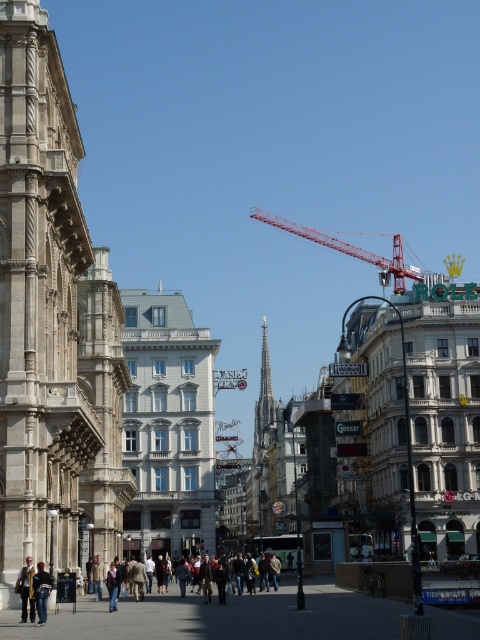
Question: Does white stone tower at left lie in front of gray stone spire at center?

Choices:
 (A) yes
 (B) no

Answer: (A)

Question: Which object appears closest to the camera in this image?

Choices:
 (A) brown leather jacket at center
 (B) dark gray jacket at lower left
 (C) light brown leather jacket at lower left
 (D) white stone tower at left

Answer: (C)

Question: Is gray stone spire at center wider than brown leather jacket at center?

Choices:
 (A) yes
 (B) no

Answer: (B)

Question: Which of the following is the farthest from the observer?

Choices:
 (A) gray stone spire at center
 (B) light brown leather jacket at lower left
 (C) dark gray jacket at lower left

Answer: (A)

Question: Can you confirm if red metallic crane at upper center is positioned to the left of light brown leather jacket at lower left?

Choices:
 (A) yes
 (B) no

Answer: (B)

Question: Which object appears closest to the camera in this image?

Choices:
 (A) dark gray jacket at lower left
 (B) brown leather jacket at center
 (C) light brown leather jacket at lower left
 (D) white stone tower at left

Answer: (C)